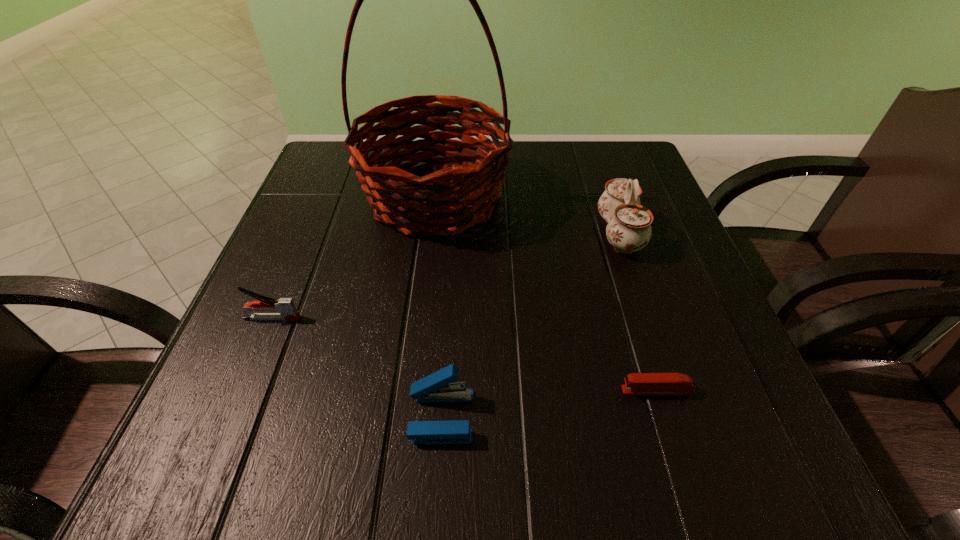
Identify the location of free space located by the handle of the chinaware. [x=549, y=234].

The image size is (960, 540). Identify the location of vacant region located on the handle side of the leftmost object. (341, 318).

Image resolution: width=960 pixels, height=540 pixels. What are the coordinates of `free space located 0.220m on the back of the second stapler from left to right` in the screenshot? It's located at (450, 281).

Where is `blank space located on the front-facing side of the shortest stapler`? blank space located on the front-facing side of the shortest stapler is located at coordinates (567, 390).

I want to click on vacant space located on the front-facing side of the shortest stapler, so click(x=382, y=390).

I want to click on vacant space located 0.180m on the front-facing side of the shortest stapler, so click(499, 390).

You are a GUI agent. You are given a task and a screenshot of the screen. Output one action in this format:
    pyautogui.click(x=<x>, y=<y>)
    Task: Click on the object located at the far edge
    
    Given the screenshot: What is the action you would take?
    pyautogui.click(x=448, y=199)

The image size is (960, 540). What are the coordinates of `object at the near edge` in the screenshot? It's located at (437, 387).

This screenshot has width=960, height=540. I want to click on basket positioned at the left edge, so click(x=448, y=199).

What are the coordinates of `stapler present at the left edge` in the screenshot? It's located at (287, 311).